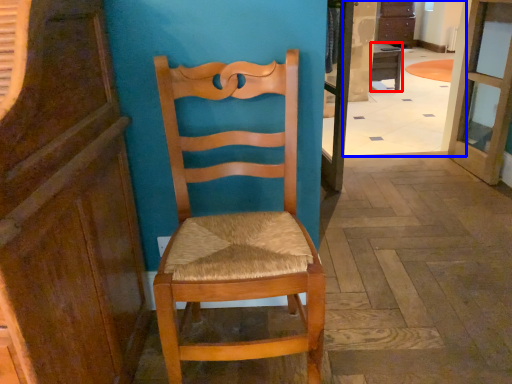
Question: Among these objects, which one is farthest to the camera, desk (highlighted by a red box) or corridor (highlighted by a blue box)?

Choices:
 (A) desk
 (B) corridor

Answer: (A)